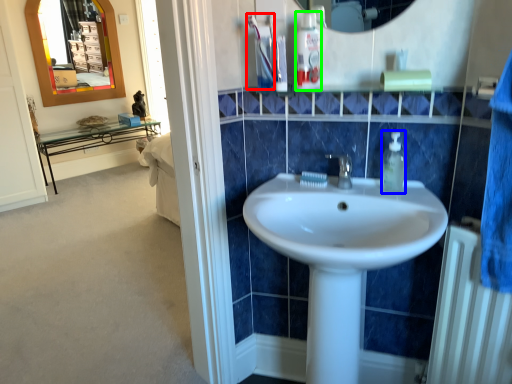
Question: Which is nearer to the toothpaste (highlighted by a red box)? soap dispenser (highlighted by a blue box) or mouthwash (highlighted by a green box).

Choices:
 (A) soap dispenser
 (B) mouthwash

Answer: (B)